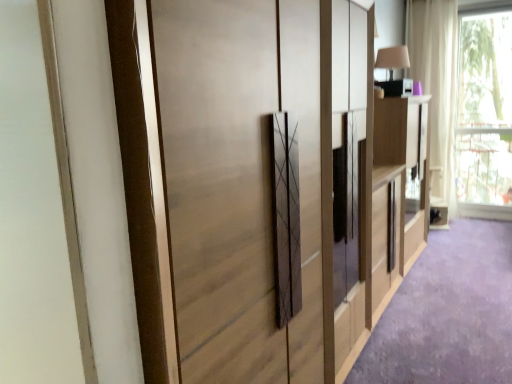
Question: Is point pos(463,173) closer or farther from the camera than point pos(435,190)?

Choices:
 (A) farther
 (B) closer

Answer: (A)

Question: From the image's perspective, is transparent glass window at upper right positioned above or below white sheer curtain at upper right?

Choices:
 (A) below
 (B) above

Answer: (A)

Question: Which of these objects is positioned farthest from the transparent glass window at upper right?

Choices:
 (A) light wood cabinet at right
 (B) white sheer curtain at upper right
 (C) matte beige table lamp at upper right
 (D) matte wood cupboard at center

Answer: (D)

Question: Which is nearer to the light wood cabinet at right?

Choices:
 (A) matte wood cupboard at center
 (B) matte beige table lamp at upper right
 (C) white sheer curtain at upper right
 (D) transparent glass window at upper right

Answer: (B)